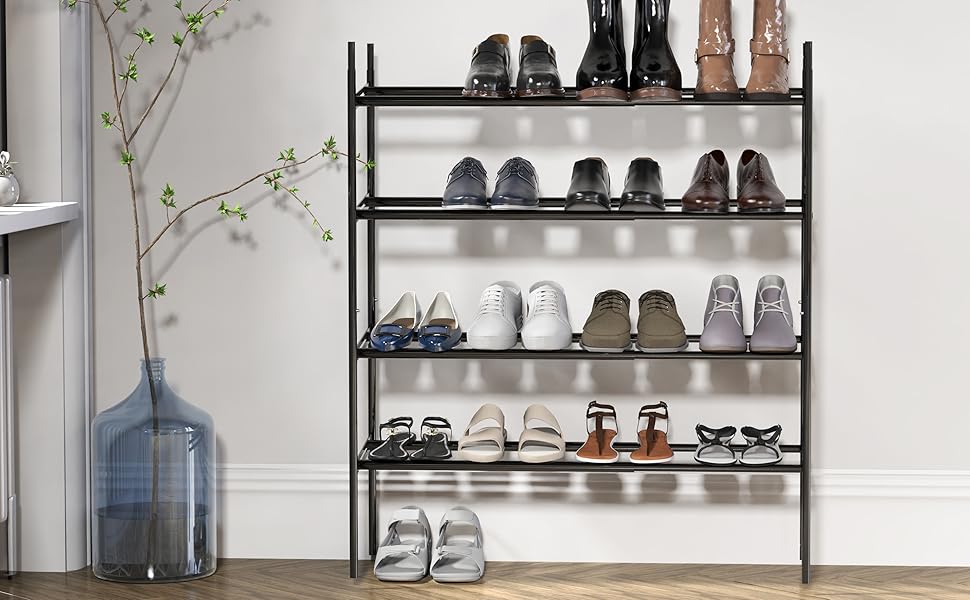
You are a GUI agent. You are given a task and a screenshot of the screen. Output one action in this format:
    pyautogui.click(x=<x>, y=<y>)
    Task: Click on the shoes on shelf below tops shelf
    The height and width of the screenshot is (600, 970).
    Given the screenshot: What is the action you would take?
    pyautogui.click(x=465, y=185), pyautogui.click(x=510, y=183), pyautogui.click(x=584, y=186), pyautogui.click(x=635, y=189), pyautogui.click(x=702, y=190), pyautogui.click(x=756, y=193)